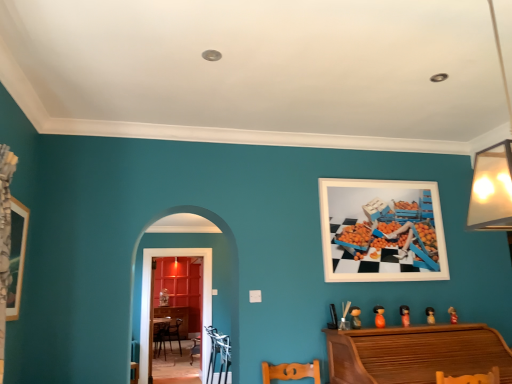
Locate an element on the screen. free space to the right of matte orange figurine at lower right, the 2th toy viewed from the right is located at coordinates (450, 325).